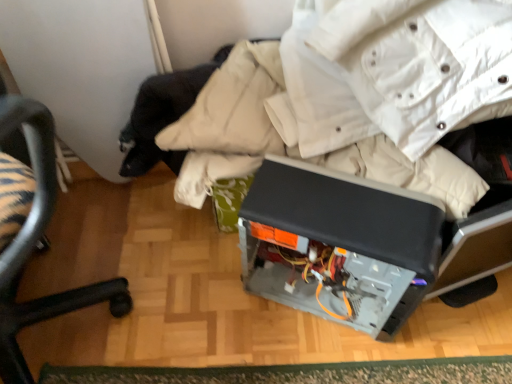
Identify the location of free region on the left part of satin black computer case at center. This screenshot has height=384, width=512. (215, 304).